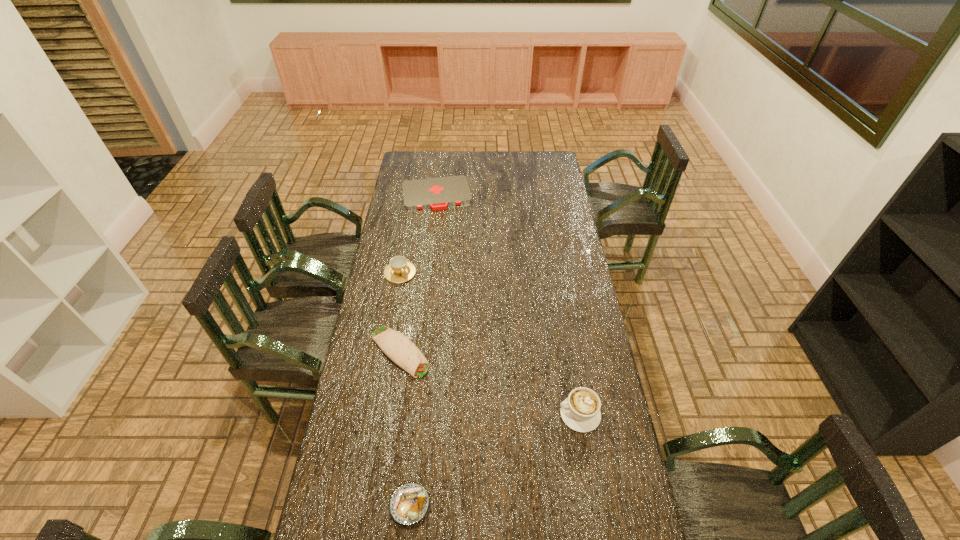
Identify the location of vacant space on the desktop that is between the pastry and the fourth farthest object and is positioned on handle side the shortest object. Image resolution: width=960 pixels, height=540 pixels. (487, 463).

Where is `vacant space on the desktop that is between the nearest object and the rightmost object and is positioned at the bitten end of the burrito`? vacant space on the desktop that is between the nearest object and the rightmost object and is positioned at the bitten end of the burrito is located at coordinates (509, 452).

Locate an element on the screen. Image resolution: width=960 pixels, height=540 pixels. free space on the desktop that is between the pastry and the tallest object and is positioned with the handle on the side of the cup is located at coordinates (503, 455).